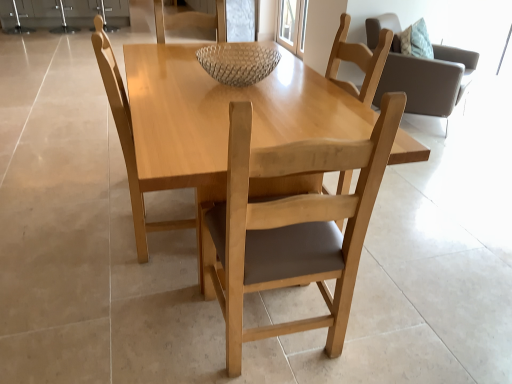
What do you see at coordinates (238, 62) in the screenshot?
I see `clear glass bowl at center` at bounding box center [238, 62].

The height and width of the screenshot is (384, 512). Describe the element at coordinates (223, 118) in the screenshot. I see `light wood table at center` at that location.

You are a GUI agent. You are given a task and a screenshot of the screen. Output one action in this format:
    pyautogui.click(x=<x>, y=<y>)
    Task: Click on the transparent glass door at upper center
    
    Given the screenshot: What is the action you would take?
    [292, 25]

In order to click on light brown wood chair at upper right, which ranks as the first chair in back-to-front order in this screenshot , I will do `click(422, 72)`.

What do you see at coordinates (127, 140) in the screenshot? This screenshot has height=384, width=512. I see `light wood chair at center, which is the 2th chair in back-to-front order` at bounding box center [127, 140].

Identify the location of clear glass bowl at center. (238, 62).

Is clear glass bowl at center located within light wood table at center?

No, light wood table at center does not contain clear glass bowl at center.

From a real-world perspective, is light wood table at center located higher than clear glass bowl at center?

Incorrect, from a real-world perspective, light wood table at center is lower than clear glass bowl at center.

Between light wood table at center and clear glass bowl at center, which one appears on the right side from the viewer's perspective?

A: From the viewer's perspective, clear glass bowl at center appears more on the right side.

Which is behind, light wood table at center or clear glass bowl at center?

clear glass bowl at center is more distant.

How different are the orientations of light wood chair at center, which is the 2th chair in back-to-front order, and transparent glass door at upper center in degrees?

180 degrees separate the facing orientations of light wood chair at center, which is the 2th chair in back-to-front order, and transparent glass door at upper center.

Does point (138, 178) appear closer or farther from the camera than point (294, 21)?

Point (138, 178) appears to be closer to the viewer than point (294, 21).

Can you confirm if light wood chair at center, which is the 2th chair in back-to-front order, is thinner than transparent glass door at upper center?

In fact, light wood chair at center, which is the 2th chair in back-to-front order, might be wider than transparent glass door at upper center.

Could you tell me if light wood chair at center, marked as the 1th chair in a left-to-right arrangement, is turned towards transparent glass door at upper center?

No, light wood chair at center, marked as the 1th chair in a left-to-right arrangement, is not turned towards transparent glass door at upper center.

Considering the points (325, 289) and (239, 86), which point is behind, point (325, 289) or point (239, 86)?

The point (239, 86) is farther from the camera.

Considering the relative sizes of light wood chair at center, which is the first chair in front-to-back order, and clear glass bowl at center in the image provided, is light wood chair at center, which is the first chair in front-to-back order, taller than clear glass bowl at center?

Correct, light wood chair at center, which is the first chair in front-to-back order, is much taller as clear glass bowl at center.

From the picture: Between light wood chair at center, the second chair viewed from the left, and clear glass bowl at center, which one has larger width?

light wood chair at center, the second chair viewed from the left.

Is light wood chair at center, the second chair viewed from the left, further to the viewer compared to clear glass bowl at center?

That is False.

From the image's perspective, would you say light wood chair at center, which is the first chair in front-to-back order, is shown under transparent glass door at upper center?

Yes.

Does light wood chair at center, the second chair viewed from the left, have a greater width compared to transparent glass door at upper center?

Yes.

In the scene shown: Is light wood chair at center, which is the first chair in front-to-back order, not within transparent glass door at upper center?

Yes, light wood chair at center, which is the first chair in front-to-back order, is outside of transparent glass door at upper center.

Is light wood chair at center, which is the third chair in back-to-front order, positioned before transparent glass door at upper center?

Yes, it is in front of transparent glass door at upper center.

Can you tell me how much clear glass bowl at center and light wood chair at center, which is the third chair in back-to-front order, differ in facing direction?

The angular difference between clear glass bowl at center and light wood chair at center, which is the third chair in back-to-front order, is 88.4 degrees.

In the scene shown: From the image's perspective, which is below, clear glass bowl at center or light wood chair at center, the second chair viewed from the left?

From the image's view, light wood chair at center, the second chair viewed from the left, is below.

You are a GUI agent. You are given a task and a screenshot of the screen. Output one action in this format:
    pyautogui.click(x=<x>, y=<y>)
    Task: Click on the glass bowl located on the left of light wood chair at center, the second chair viewed from the left
    The height and width of the screenshot is (384, 512).
    Given the screenshot: What is the action you would take?
    pyautogui.click(x=238, y=62)

Would you say clear glass bowl at center contains light wood chair at center, which is the second chair in right-to-left order?

That's incorrect, light wood chair at center, which is the second chair in right-to-left order, is not inside clear glass bowl at center.

How many degrees apart are the facing directions of light wood table at center and light wood chair at center, the second chair viewed from the left?

light wood table at center and light wood chair at center, the second chair viewed from the left, are facing 87.2 degrees away from each other.

Does light wood table at center turn towards light wood chair at center, the second chair viewed from the left?

No, light wood table at center is not turned towards light wood chair at center, the second chair viewed from the left.

From the image's perspective, is light wood table at center above or below light wood chair at center, which is the first chair in front-to-back order?

light wood table at center is situated higher than light wood chair at center, which is the first chair in front-to-back order, in the image.

This screenshot has width=512, height=384. Find the location of `round table located underneath the light wood chair at center, which is the second chair in right-to-left order (from a real-world perspective)`. round table located underneath the light wood chair at center, which is the second chair in right-to-left order (from a real-world perspective) is located at coordinates (223, 118).

Is light wood chair at center, which is the third chair in back-to-front order, positioned with its back to light wood table at center?

Correct, light wood chair at center, which is the third chair in back-to-front order, is looking away from light wood table at center.

Looking at this image, which is more to the left, light wood chair at center, which is the first chair in front-to-back order, or light wood table at center?

Positioned to the left is light wood table at center.

Who is shorter, light wood chair at center, the second chair viewed from the left, or light wood table at center?

light wood table at center.

At what (x,y) coordinates should I click in order to perform the action: click on chair below the light wood table at center (from the image's perspective). Please return your answer as a coordinate pair (x, y). This screenshot has height=384, width=512. Looking at the image, I should click on (294, 226).

Where is `round table that is in front of the clear glass bowl at center`? round table that is in front of the clear glass bowl at center is located at coordinates (223, 118).

Locate an element on the screen. This screenshot has height=384, width=512. the 2nd chair counting from the left of the transparent glass door at upper center is located at coordinates (127, 140).

From the image, which object appears to be farther from clear glass bowl at center, light wood chair at center, which is the 2th chair in back-to-front order, or light wood chair at center, which is the first chair in front-to-back order?

light wood chair at center, which is the first chair in front-to-back order, lies further to clear glass bowl at center than the other object.

Considering their positions, is light wood chair at center, the second chair viewed from the left, positioned closer to light wood chair at center, which appears as the third chair when viewed from the right, than transparent glass door at upper center?

Among the two, light wood chair at center, the second chair viewed from the left, is located nearer to light wood chair at center, which appears as the third chair when viewed from the right.

Based on their spatial positions, is light wood chair at center, which is the 2th chair in back-to-front order, or light wood table at center closer to clear glass bowl at center?

light wood table at center is closer to clear glass bowl at center.

Which object lies further to the anchor point light wood chair at center, the second chair viewed from the left, light wood chair at center, which is the 2th chair in back-to-front order, or clear glass bowl at center?

clear glass bowl at center is positioned further to the anchor light wood chair at center, the second chair viewed from the left.

Looking at the image, which one is located further to light wood table at center, light wood chair at center, which is the third chair in back-to-front order, or clear glass bowl at center?

light wood chair at center, which is the third chair in back-to-front order.

Based on their spatial positions, is light wood chair at center, the second chair from the front, or transparent glass door at upper center further from light wood chair at center, which is the second chair in right-to-left order?

transparent glass door at upper center is further to light wood chair at center, which is the second chair in right-to-left order.

Estimate the real-world distances between objects in this image. Which object is closer to light brown wood chair at upper right, which is the 1th chair from right to left, clear glass bowl at center or transparent glass door at upper center?

transparent glass door at upper center is positioned closer to the anchor light brown wood chair at upper right, which is the 1th chair from right to left.

Estimate the real-world distances between objects in this image. Which object is further from clear glass bowl at center, light brown wood chair at upper right, which is the third chair in front-to-back order, or light wood chair at center, marked as the 1th chair in a left-to-right arrangement?

light brown wood chair at upper right, which is the third chair in front-to-back order, lies further to clear glass bowl at center than the other object.

At what (x,y) coordinates should I click in order to perform the action: click on chair between light wood chair at center, the second chair from the front, and transparent glass door at upper center from front to back. Please return your answer as a coordinate pair (x, y). The image size is (512, 384). Looking at the image, I should click on (422, 72).

Where is `round table between light wood chair at center, the second chair viewed from the left, and clear glass bowl at center from front to back`? This screenshot has width=512, height=384. round table between light wood chair at center, the second chair viewed from the left, and clear glass bowl at center from front to back is located at coordinates (223, 118).

At what (x,y) coordinates should I click in order to perform the action: click on round table between light wood chair at center, which is the second chair in right-to-left order, and light brown wood chair at upper right, the third chair viewed from the left, along the z-axis. Please return your answer as a coordinate pair (x, y). Looking at the image, I should click on tap(223, 118).

Locate an element on the screen. chair between light wood table at center and light brown wood chair at upper right, which is the third chair in front-to-back order, from front to back is located at coordinates (127, 140).